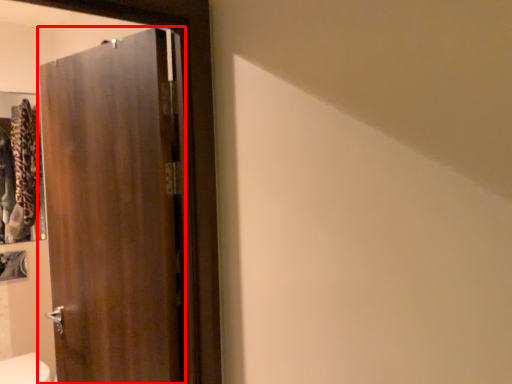
Question: From the image's perspective, considering the relative positions of door (annotated by the red box) and bidet in the image provided, where is door (annotated by the red box) located with respect to the staircase?

Choices:
 (A) above
 (B) below

Answer: (A)